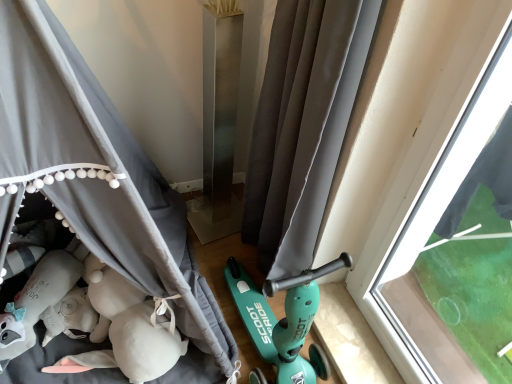
Question: From the image's perspective, does transparent glass window at right appear lower than gray fabric curtain at center, which ranks as the second curtain in right-to-left order?

Choices:
 (A) yes
 (B) no

Answer: (A)

Question: From a real-world perspective, is transparent glass window at right physically below gray fabric curtain at center, arranged as the 1th curtain when viewed from the left?

Choices:
 (A) no
 (B) yes

Answer: (B)

Question: Is transparent glass window at right positioned with its back to gray fabric curtain at center, arranged as the 1th curtain when viewed from the left?

Choices:
 (A) yes
 (B) no

Answer: (B)

Question: Can you see transparent glass window at right touching gray fabric curtain at center, which ranks as the second curtain in right-to-left order?

Choices:
 (A) no
 (B) yes

Answer: (A)

Question: Does transparent glass window at right lie in front of gray fabric curtain at center, which ranks as the second curtain in right-to-left order?

Choices:
 (A) no
 (B) yes

Answer: (A)

Question: Do you think gray fabric curtain at center, arranged as the 1th curtain when viewed from the left, is within gray fabric curtain at center, arranged as the 2th curtain when viewed from the left, or outside of it?

Choices:
 (A) outside
 (B) inside

Answer: (A)

Question: From a real-world perspective, is gray fabric curtain at center, which ranks as the second curtain in right-to-left order, above or below gray fabric curtain at center, arranged as the 2th curtain when viewed from the left?

Choices:
 (A) below
 (B) above

Answer: (B)

Question: Is gray fabric curtain at center, arranged as the 1th curtain when viewed from the left, wider or thinner than gray fabric curtain at center, arranged as the 2th curtain when viewed from the left?

Choices:
 (A) thin
 (B) wide

Answer: (B)

Question: In the image, is gray fabric curtain at center, which ranks as the second curtain in right-to-left order, on the left side or the right side of gray fabric curtain at center, arranged as the 2th curtain when viewed from the left?

Choices:
 (A) right
 (B) left

Answer: (B)

Question: From their relative heights in the image, would you say gray fabric curtain at center, arranged as the 2th curtain when viewed from the left, is taller or shorter than gray fabric curtain at center, arranged as the 1th curtain when viewed from the left?

Choices:
 (A) tall
 (B) short

Answer: (B)

Question: Considering the positions of gray fabric curtain at center, the 1th curtain in the right-to-left sequence, and gray fabric curtain at center, which ranks as the second curtain in right-to-left order, in the image, is gray fabric curtain at center, the 1th curtain in the right-to-left sequence, bigger or smaller than gray fabric curtain at center, which ranks as the second curtain in right-to-left order,?

Choices:
 (A) small
 (B) big

Answer: (A)

Question: From a real-world perspective, relative to gray fabric curtain at center, which ranks as the second curtain in right-to-left order, is gray fabric curtain at center, the 1th curtain in the right-to-left sequence, vertically above or below?

Choices:
 (A) below
 (B) above

Answer: (A)

Question: Visually, is gray fabric curtain at center, the 1th curtain in the right-to-left sequence, positioned to the left or to the right of gray fabric curtain at center, arranged as the 1th curtain when viewed from the left?

Choices:
 (A) right
 (B) left

Answer: (A)

Question: Is gray fabric curtain at center, arranged as the 1th curtain when viewed from the left, in front of or behind transparent glass window at right in the image?

Choices:
 (A) front
 (B) behind

Answer: (A)

Question: Considering the positions of gray fabric curtain at center, which ranks as the second curtain in right-to-left order, and transparent glass window at right in the image, is gray fabric curtain at center, which ranks as the second curtain in right-to-left order, wider or thinner than transparent glass window at right?

Choices:
 (A) wide
 (B) thin

Answer: (A)